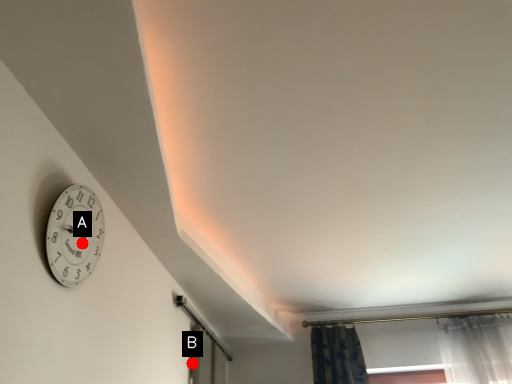
Question: Two points are circled on the image, labeled by A and B beside each circle. Among these points, which one is farthest from the camera?

Choices:
 (A) A is further
 (B) B is further

Answer: (B)